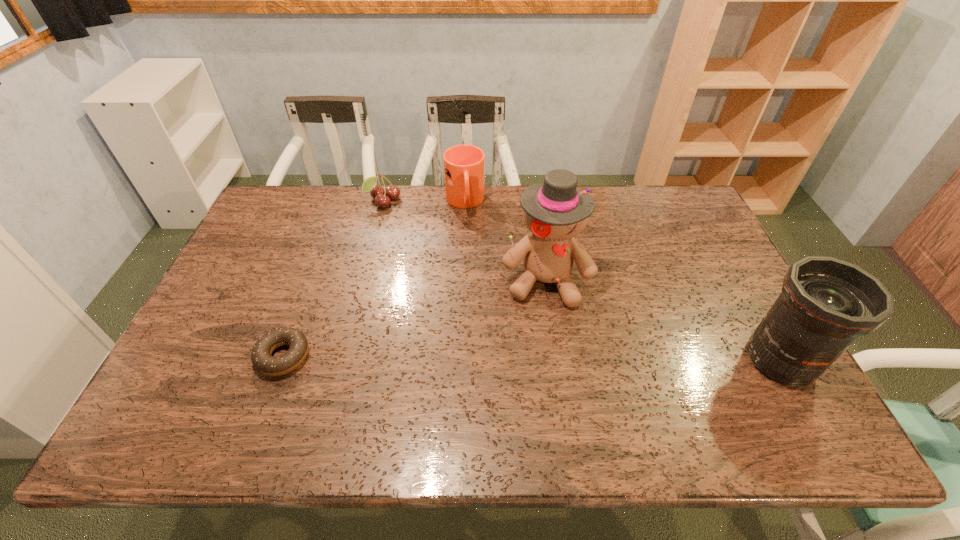
In order to click on doughnut in this screenshot , I will do point(261,358).

The image size is (960, 540). Identify the location of the leftmost object. (261, 358).

The width and height of the screenshot is (960, 540). In order to click on the rightmost object in this screenshot , I will do `click(826, 303)`.

Identify the location of telephoto lens. 826,303.

Identify the location of mug. Image resolution: width=960 pixels, height=540 pixels. tap(464, 165).

At what (x,y) coordinates should I click in order to perform the action: click on the third shortest object. Please return your answer as a coordinate pair (x, y). Image resolution: width=960 pixels, height=540 pixels. Looking at the image, I should click on (464, 165).

Locate an element on the screen. The image size is (960, 540). rag_doll is located at coordinates (555, 212).

Locate an element on the screen. the tallest object is located at coordinates (555, 212).

This screenshot has width=960, height=540. I want to click on cherry, so click(382, 198).

Where is `the fourth tallest object`? the fourth tallest object is located at coordinates (382, 198).